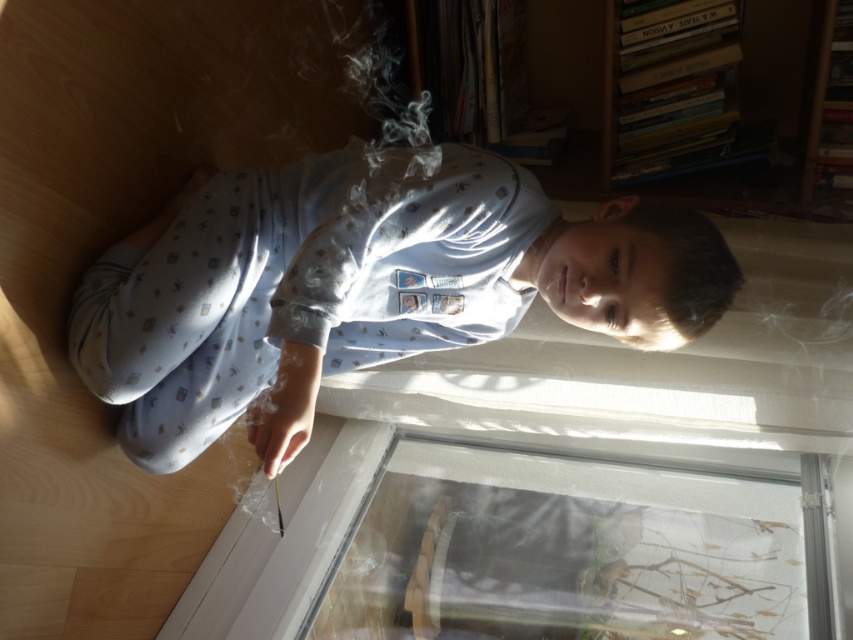
Question: Is light blue cotton pajamas at center smaller than transparent glass door at lower center?

Choices:
 (A) no
 (B) yes

Answer: (A)

Question: Can you confirm if light blue cotton pajamas at center is positioned below transparent glass door at lower center?

Choices:
 (A) no
 (B) yes

Answer: (A)

Question: Is light blue cotton pajamas at center closer to the viewer compared to wooden bookshelf at upper right?

Choices:
 (A) no
 (B) yes

Answer: (B)

Question: Estimate the real-world distances between objects in this image. Which object is farther from the light blue cotton pajamas at center?

Choices:
 (A) wooden bookshelf at upper right
 (B) transparent glass door at lower center

Answer: (A)

Question: Which object is farther from the camera taking this photo?

Choices:
 (A) transparent glass door at lower center
 (B) light blue cotton pajamas at center
 (C) wooden bookshelf at upper right

Answer: (C)

Question: Which point is farther from the camera taking this photo?

Choices:
 (A) (351, 580)
 (B) (433, 301)
 (C) (775, 67)

Answer: (C)